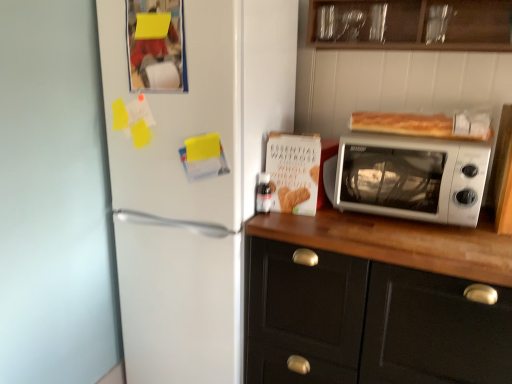
Question: Considering the positions of golden brown crusty bread at upper right and white plastic microwave at upper right in the image, is golden brown crusty bread at upper right wider or thinner than white plastic microwave at upper right?

Choices:
 (A) wide
 (B) thin

Answer: (B)

Question: Considering the positions of point (395, 122) and point (338, 198), is point (395, 122) closer or farther from the camera than point (338, 198)?

Choices:
 (A) closer
 (B) farther

Answer: (A)

Question: Considering the real-world distances, which object is closest to the golden brown crusty bread at upper right?

Choices:
 (A) white plastic microwave at upper right
 (B) white matte refrigerator at left
 (C) wooden cabinet at upper center, arranged as the second cabinetry when ordered from the bottom
 (D) white matte cabinet at right, arranged as the 2th cabinetry when viewed from the top

Answer: (A)

Question: Considering the real-world distances, which object is closest to the golden brown crusty bread at upper right?

Choices:
 (A) white plastic microwave at upper right
 (B) wooden cabinet at upper center, arranged as the second cabinetry when ordered from the bottom
 (C) white matte refrigerator at left
 (D) white matte cabinet at right, positioned as the 1th cabinetry in bottom-to-top order

Answer: (A)